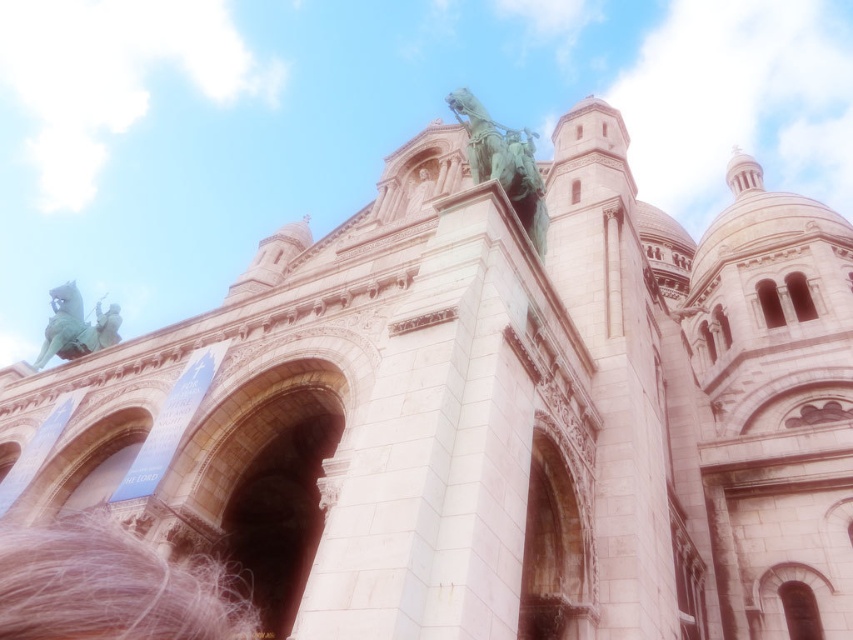
Question: Can you confirm if pink hair at lower left is positioned to the left of green patina metal statue at upper center?

Choices:
 (A) no
 (B) yes

Answer: (B)

Question: Which point appears closest to the camera in this image?

Choices:
 (A) (531, 182)
 (B) (78, 332)

Answer: (A)

Question: Does pink hair at lower left have a lesser width compared to green patina metal statue at upper center?

Choices:
 (A) no
 (B) yes

Answer: (A)

Question: Which of the following is the closest to the observer?

Choices:
 (A) green patina statue at upper center
 (B) pink hair at lower left

Answer: (B)

Question: Which is farther from the pink hair at lower left?

Choices:
 (A) green patina statue at upper center
 (B) green patina metal statue at upper center

Answer: (A)

Question: Is pink hair at lower left positioned in front of green patina metal statue at upper center?

Choices:
 (A) yes
 (B) no

Answer: (A)